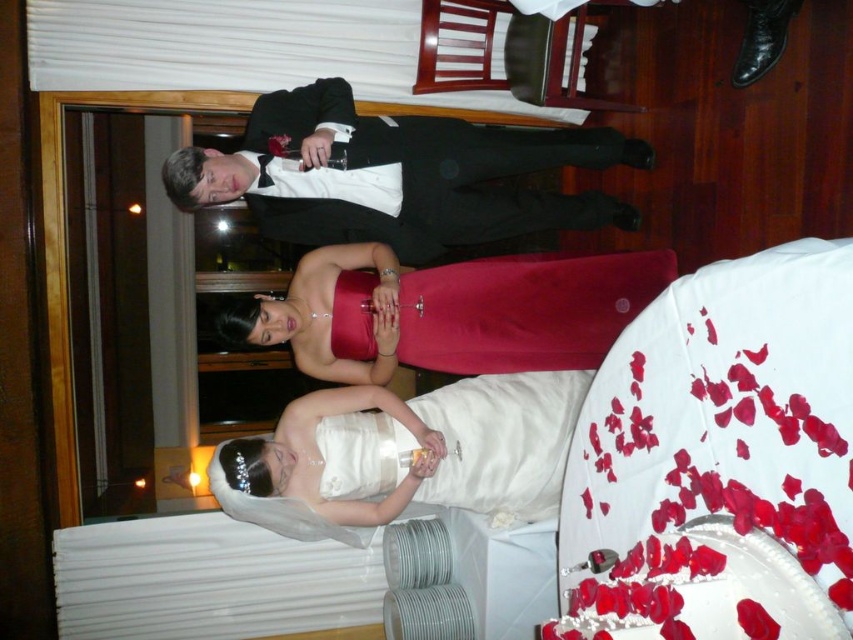
Question: Which point is closer to the camera?

Choices:
 (A) white satin dress at lower center
 (B) black satin tuxedo at upper center
 (C) satin red dress at center

Answer: (B)

Question: Can you confirm if satin red dress at center is positioned to the left of white satin dress at lower center?

Choices:
 (A) no
 (B) yes

Answer: (A)

Question: From the image, what is the correct spatial relationship of satin red dress at center in relation to white satin dress at lower center?

Choices:
 (A) right
 (B) left

Answer: (A)

Question: Among these points, which one is farthest from the camera?

Choices:
 (A) (579, 292)
 (B) (264, 188)

Answer: (A)

Question: Which object is closer to the camera taking this photo?

Choices:
 (A) satin red dress at center
 (B) white satin dress at lower center

Answer: (B)

Question: Is satin red dress at center bigger than white satin dress at lower center?

Choices:
 (A) yes
 (B) no

Answer: (B)